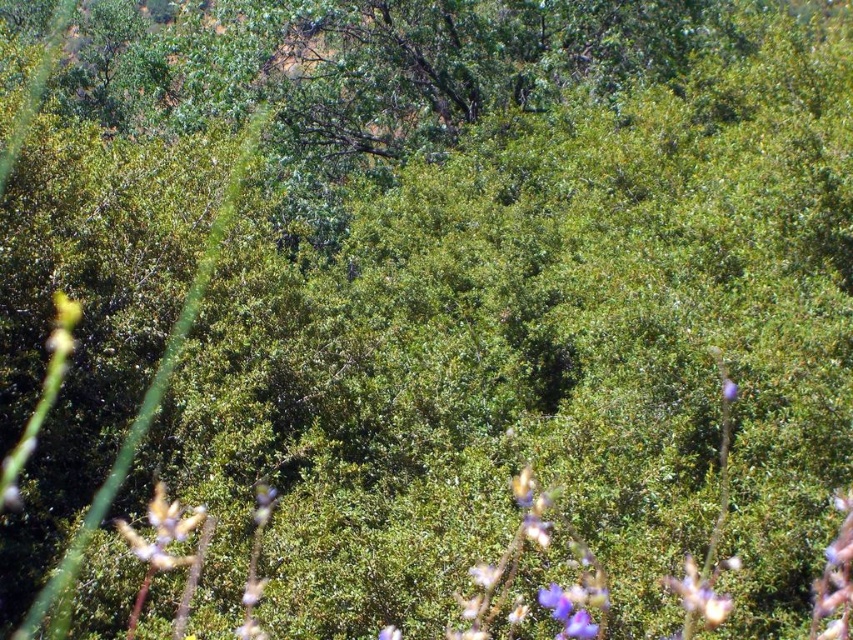
You are standing at the center of the scene and want to pick the purple matte flower at lower right. Which direction should you move to reach it?

Since the purple matte flower at lower right is located at coordinates approximately 0.933 on the x axis and 0.819 on the y axis, you should move towards the lower right direction to reach it.

You are standing in the middle of the dense green landscape and want to walk towards the two points marked in the image. Which point, point (170,524) or point (728,396), will you reach first?

You will reach point (170,524) first because it is closer to you than point (728,396), which is further away.